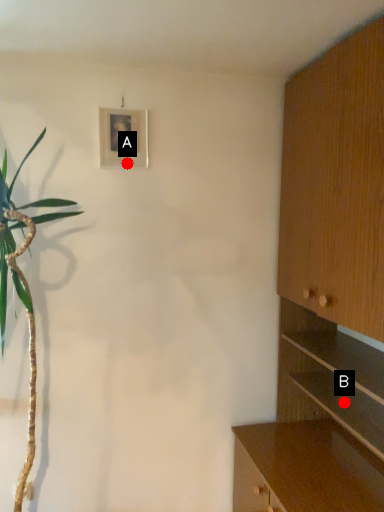
Question: Two points are circled on the image, labeled by A and B beside each circle. Which point is farther to the camera?

Choices:
 (A) A is further
 (B) B is further

Answer: (A)